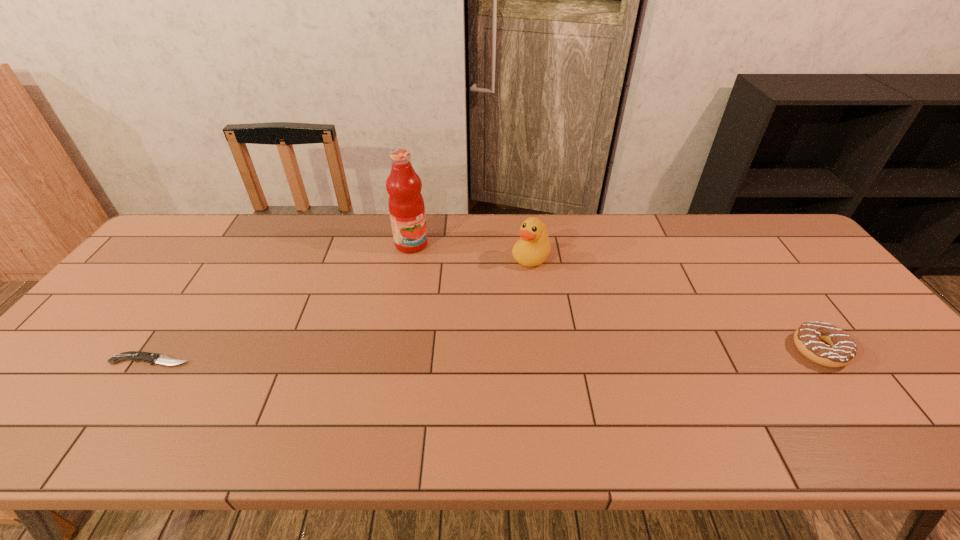
Identify the location of vacant space that satisfies the following two spatial constraints: 1. on the back side of the third object from left to right; 2. on the right side of the leftmost object. (222, 257).